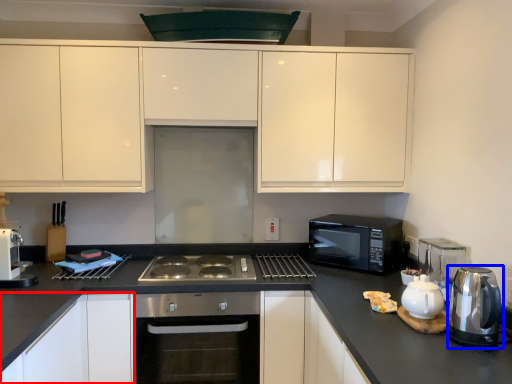
Question: Which object is further to the camera taking this photo, cabinetry (highlighted by a red box) or kitchen appliance (highlighted by a blue box)?

Choices:
 (A) cabinetry
 (B) kitchen appliance

Answer: (A)